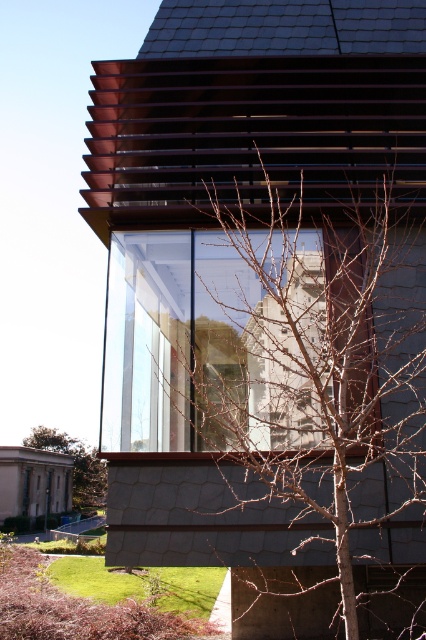
You are standing in front of the modern building and want to take a photo of the glass wall. There are two points marked on your camera screen at coordinates point [149,348] and point [101,483]. Which point is closer to you when focusing on the glass wall?

Point [149,348] is closer to the camera than point [101,483].

You are a photographer trying to capture the modern building with its glass wall. You notice the bare branches at center and the brown leafless tree at lower left in your shot. Which object is closer to the right edge of your photo?

The bare branches at center is positioned on the right side of brown leafless tree at lower left, so the bare branches at center is closer to the right edge of the photo.